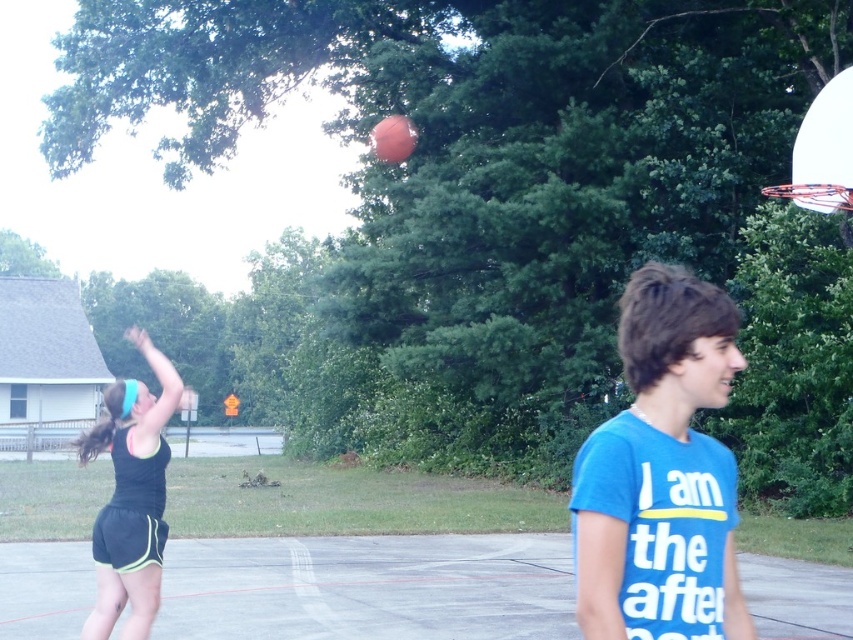
Question: Which point appears farthest from the camera in this image?

Choices:
 (A) (634, 385)
 (B) (809, 108)
 (C) (370, 148)
 (D) (804, 621)

Answer: (C)

Question: Can you confirm if black athletic wear at left is positioned to the left of glossy orange basketball at upper center?

Choices:
 (A) no
 (B) yes

Answer: (B)

Question: Can you confirm if concrete court at center is positioned above blue cotton t-shirt at center?

Choices:
 (A) no
 (B) yes

Answer: (A)

Question: Among these points, which one is nearest to the camera?

Choices:
 (A) (598, 611)
 (B) (844, 209)

Answer: (A)

Question: Which object is farther from the camera taking this photo?

Choices:
 (A) concrete court at center
 (B) white glossy basketball hoop at upper right
 (C) black athletic wear at left

Answer: (B)

Question: Is blue cotton t-shirt at center below black athletic wear at left?

Choices:
 (A) yes
 (B) no

Answer: (A)